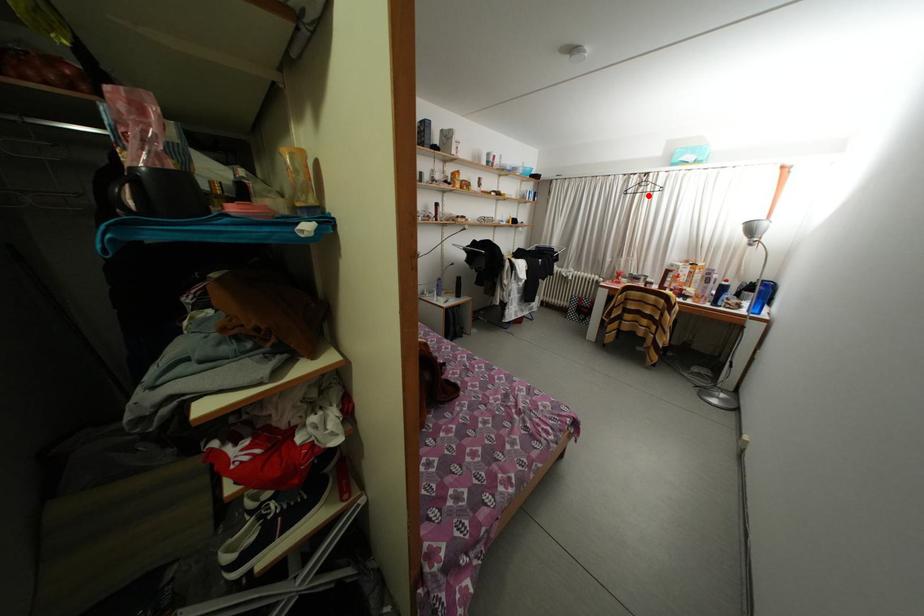
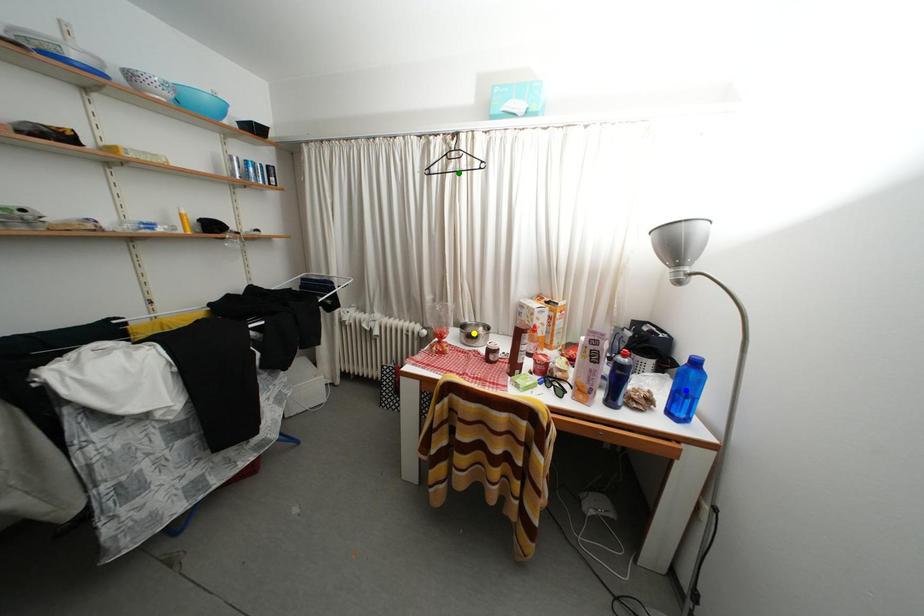
Question: I am providing you with two images of the same scene from different viewpoints. A red point is marked on the first image. You are given multiple points on the second image. Which spot in image 2 lines up with the point in image 1?

Choices:
 (A) blue point
 (B) yellow point
 (C) green point

Answer: (C)